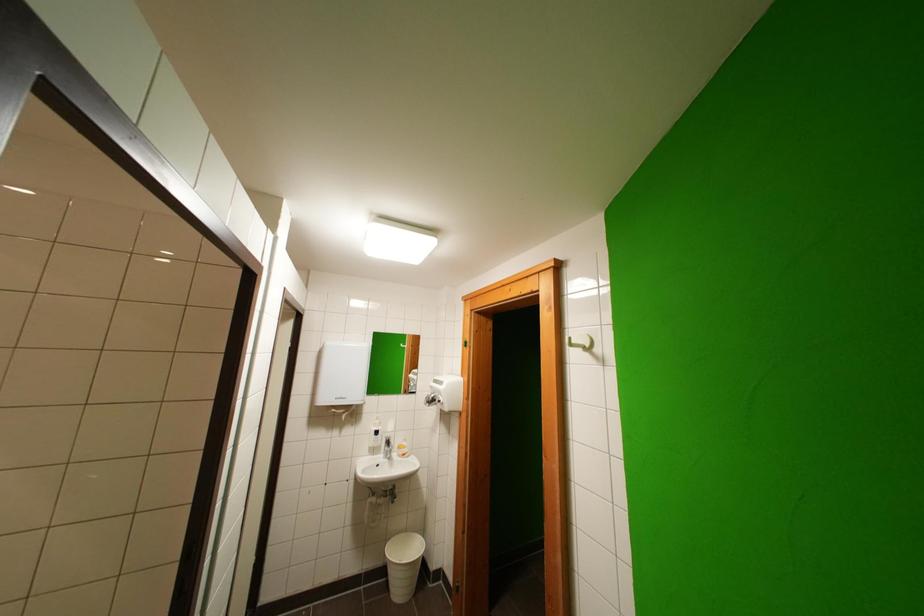
What do you see at coordinates (387, 439) in the screenshot? I see `a faucet handle` at bounding box center [387, 439].